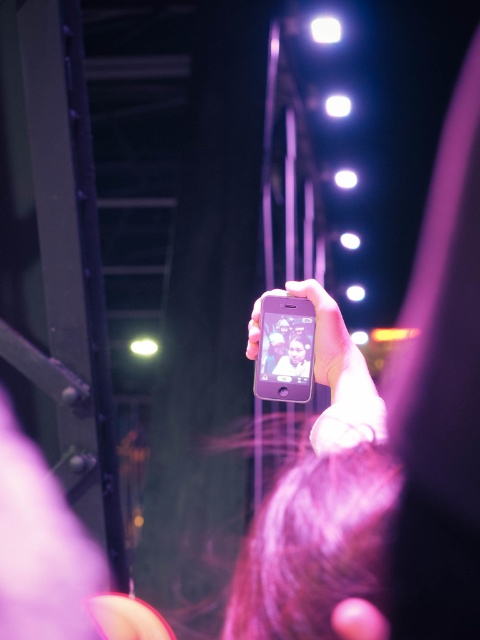
Between point (312, 384) and point (252, 353), which one is positioned behind?

The point (252, 353) is more distant.

Who is higher up, matte black smartphone at center or matte silver phone at center?

matte silver phone at center

Locate an element on the screen. The width and height of the screenshot is (480, 640). matte black smartphone at center is located at coordinates (285, 349).

Where is `matte black smartphone at center`? The image size is (480, 640). matte black smartphone at center is located at coordinates (285, 349).

Between matte purple phone at center and matte silver phone at center, which one is positioned higher?

matte silver phone at center

Does matte purple phone at center have a larger size compared to matte silver phone at center?

Yes.

Measure the distance between matte purple phone at center and camera.

matte purple phone at center is 69.03 centimeters from camera.

Locate an element on the screen. matte purple phone at center is located at coordinates (333, 344).

This screenshot has width=480, height=640. What do you see at coordinates (285, 349) in the screenshot? I see `matte black smartphone at center` at bounding box center [285, 349].

Is matte black smartphone at center wider than matte purple phone at center?

In fact, matte black smartphone at center might be narrower than matte purple phone at center.

At what (x,y) coordinates should I click in order to perform the action: click on matte black smartphone at center. Please return your answer as a coordinate pair (x, y). This screenshot has height=640, width=480. Looking at the image, I should click on (285, 349).